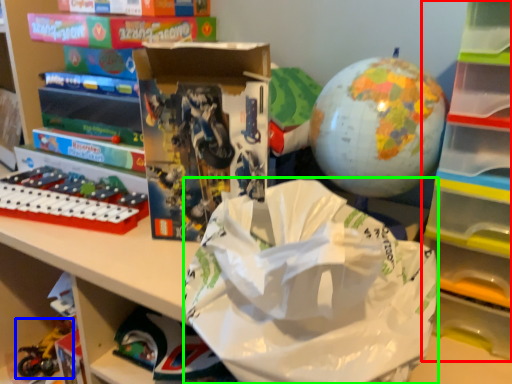
Question: Which object is the closest to the bookshelf (highlighted by a red box)? Choose among these: toy (highlighted by a blue box) or grocery bag (highlighted by a green box).

Choices:
 (A) toy
 (B) grocery bag

Answer: (B)